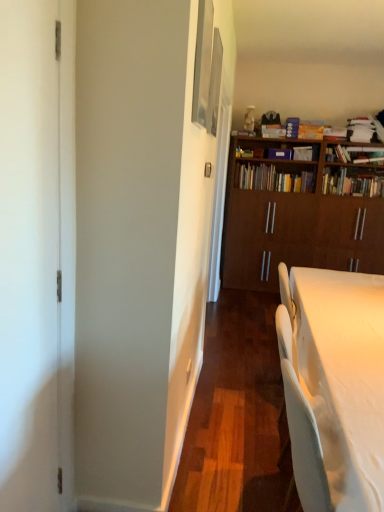
Question: Which direction should I rotate to look at metallic silver picture frame at upper center, acting as the 1th picture frame starting from the front?

Choices:
 (A) left
 (B) right

Answer: (B)

Question: Can you confirm if wooden bookshelf at center, the third book in the right-to-left sequence, is positioned to the left of metallic silver picture frame at upper center, acting as the second picture frame starting from the back?

Choices:
 (A) no
 (B) yes

Answer: (A)

Question: From a real-world perspective, is wooden bookshelf at center, the third book in the right-to-left sequence, physically above metallic silver picture frame at upper center, acting as the second picture frame starting from the back?

Choices:
 (A) yes
 (B) no

Answer: (B)

Question: Considering the relative sizes of wooden bookshelf at center, the first book positioned from the left, and metallic silver picture frame at upper center, acting as the second picture frame starting from the back, in the image provided, is wooden bookshelf at center, the first book positioned from the left, taller than metallic silver picture frame at upper center, acting as the second picture frame starting from the back,?

Choices:
 (A) yes
 (B) no

Answer: (B)

Question: Considering the relative sizes of wooden bookshelf at center, the first book positioned from the left, and metallic silver picture frame at upper center, acting as the 1th picture frame starting from the front, in the image provided, is wooden bookshelf at center, the first book positioned from the left, thinner than metallic silver picture frame at upper center, acting as the 1th picture frame starting from the front,?

Choices:
 (A) yes
 (B) no

Answer: (B)

Question: Is wooden bookshelf at center, the first book positioned from the left, outside of metallic silver picture frame at upper center, acting as the 1th picture frame starting from the front?

Choices:
 (A) no
 (B) yes

Answer: (B)

Question: Considering the relative positions of wooden bookshelf at center, the first book positioned from the left, and metallic silver picture frame at upper center, acting as the second picture frame starting from the back, in the image provided, is wooden bookshelf at center, the first book positioned from the left, to the right of metallic silver picture frame at upper center, acting as the second picture frame starting from the back, from the viewer's perspective?

Choices:
 (A) no
 (B) yes

Answer: (B)

Question: Is metallic silver picture frame at upper center, acting as the 1th picture frame starting from the front, wider than metallic silver picture frame at upper center, the 1th picture frame when ordered from back to front?

Choices:
 (A) no
 (B) yes

Answer: (B)

Question: From the image's perspective, would you say metallic silver picture frame at upper center, acting as the 1th picture frame starting from the front, is positioned over metallic silver picture frame at upper center, which is the 2th picture frame in front-to-back order?

Choices:
 (A) no
 (B) yes

Answer: (A)

Question: Is metallic silver picture frame at upper center, acting as the second picture frame starting from the back, shorter than metallic silver picture frame at upper center, which is the 2th picture frame in front-to-back order?

Choices:
 (A) yes
 (B) no

Answer: (B)

Question: From a real-world perspective, is metallic silver picture frame at upper center, acting as the 1th picture frame starting from the front, on metallic silver picture frame at upper center, which is the 2th picture frame in front-to-back order?

Choices:
 (A) yes
 (B) no

Answer: (B)

Question: Is metallic silver picture frame at upper center, acting as the 1th picture frame starting from the front, taller than metallic silver picture frame at upper center, the 1th picture frame when ordered from back to front?

Choices:
 (A) yes
 (B) no

Answer: (A)

Question: Does metallic silver picture frame at upper center, acting as the 1th picture frame starting from the front, have a larger size compared to metallic silver picture frame at upper center, the 1th picture frame when ordered from back to front?

Choices:
 (A) no
 (B) yes

Answer: (B)

Question: Can we say white glossy desk at lower right lies outside wooden bookshelf at upper right, the first book positioned from the right?

Choices:
 (A) yes
 (B) no

Answer: (A)